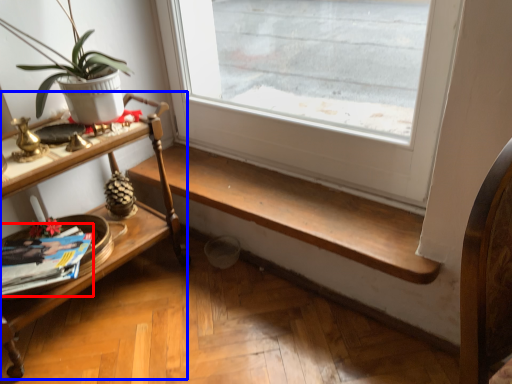
Question: Which object is closer to the camera taking this photo, magazine (highlighted by a red box) or shelf (highlighted by a blue box)?

Choices:
 (A) magazine
 (B) shelf

Answer: (B)